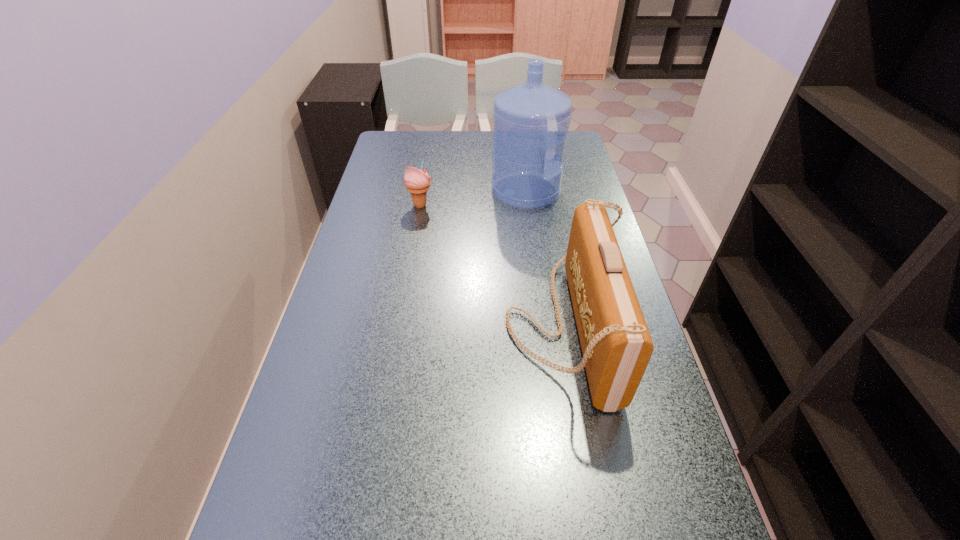
The height and width of the screenshot is (540, 960). What are the coordinates of `object at the left edge` in the screenshot? It's located at (417, 182).

In order to click on water jug that is at the right edge in this screenshot , I will do `click(528, 119)`.

Locate an element on the screen. handbag present at the right edge is located at coordinates (616, 345).

The image size is (960, 540). In the image, there is a desktop. Find the location of `vacant area at the far edge`. vacant area at the far edge is located at coordinates (481, 161).

Find the location of `vacant space at the left edge of the desktop`. vacant space at the left edge of the desktop is located at coordinates (380, 278).

You are a GUI agent. You are given a task and a screenshot of the screen. Output one action in this format:
    pyautogui.click(x=<x>, y=<y>)
    Task: Click on the free space at the right edge of the desktop
    The image size is (960, 540).
    Given the screenshot: What is the action you would take?
    pyautogui.click(x=581, y=162)

In order to click on blank region between the shortest object and the second tallest object in this screenshot , I will do `click(492, 265)`.

Where is `free spot between the icecream and the tallest object`? The height and width of the screenshot is (540, 960). free spot between the icecream and the tallest object is located at coordinates (473, 198).

At what (x,y) coordinates should I click in order to perform the action: click on free spot between the icecream and the handbag. Please return your answer as a coordinate pair (x, y). This screenshot has height=540, width=960. Looking at the image, I should click on (492, 265).

Identify the location of the second closest object relative to the icecream. The height and width of the screenshot is (540, 960). (616, 345).